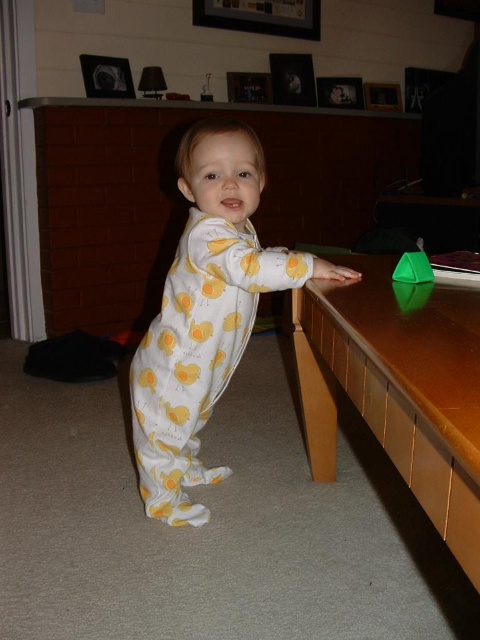
Question: Based on their relative distances, which object is farther from the green plastic toy at right?

Choices:
 (A) white/yellow duck print jumpsuit at center
 (B) brown wooden table at right

Answer: (A)

Question: Which object is closer to the camera taking this photo?

Choices:
 (A) green plastic toy at right
 (B) white/yellow duck print jumpsuit at center

Answer: (B)

Question: Does brown wooden table at right appear under white/yellow duck print jumpsuit at center?

Choices:
 (A) no
 (B) yes

Answer: (A)

Question: Considering the relative positions of white/yellow duck print jumpsuit at center and green plastic toy at right in the image provided, where is white/yellow duck print jumpsuit at center located with respect to green plastic toy at right?

Choices:
 (A) left
 (B) right

Answer: (A)

Question: Is white/yellow duck print jumpsuit at center thinner than green plastic toy at right?

Choices:
 (A) no
 (B) yes

Answer: (A)

Question: Which point is farther to the camera?

Choices:
 (A) (245, 314)
 (B) (400, 305)

Answer: (A)